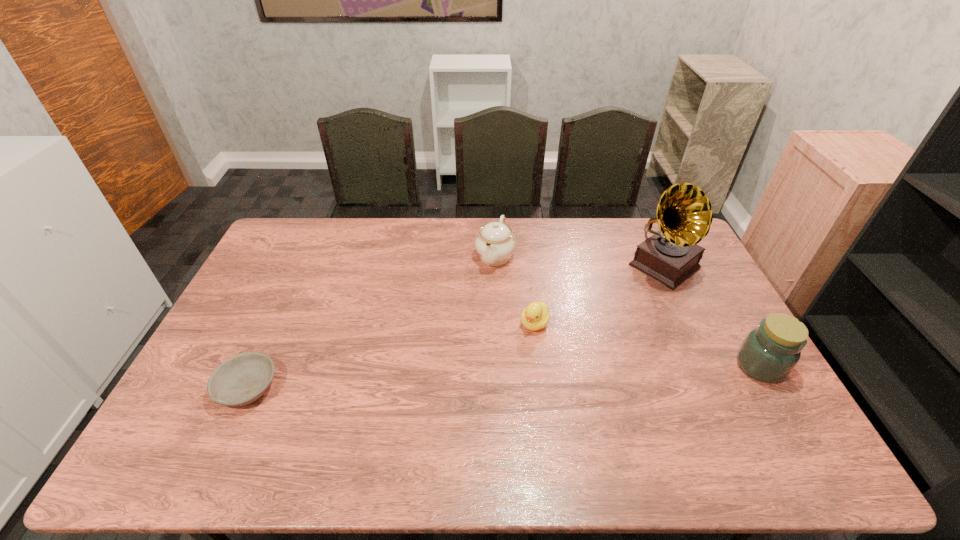
Where is `object present at the near edge`? object present at the near edge is located at coordinates (242, 379).

Find the location of a particular element. The width and height of the screenshot is (960, 540). object located in the left edge section of the desktop is located at coordinates (242, 379).

The height and width of the screenshot is (540, 960). In order to click on jar that is at the right edge in this screenshot , I will do `click(769, 353)`.

Where is `phonograph record present at the right edge`? This screenshot has width=960, height=540. phonograph record present at the right edge is located at coordinates (671, 255).

At what (x,y) coordinates should I click in order to perform the action: click on object at the near left corner. Please return your answer as a coordinate pair (x, y). This screenshot has height=540, width=960. Looking at the image, I should click on coord(242,379).

Locate an element on the screen. object at the far right corner is located at coordinates (671, 255).

Find the location of a particular element. Image resolution: width=960 pixels, height=540 pixels. vacant space at the far edge is located at coordinates coord(492,221).

Image resolution: width=960 pixels, height=540 pixels. I want to click on free space at the near edge of the desktop, so click(x=458, y=422).

The image size is (960, 540). In the image, there is a desktop. What are the coordinates of `free space at the left edge` in the screenshot? It's located at (272, 264).

What are the coordinates of `vacant space at the right edge of the desktop` in the screenshot? It's located at (721, 340).